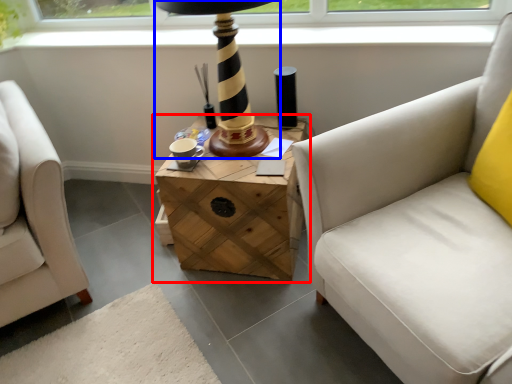
Question: Which point is further to the camera, table (highlighted by a red box) or table lamp (highlighted by a blue box)?

Choices:
 (A) table
 (B) table lamp

Answer: (A)